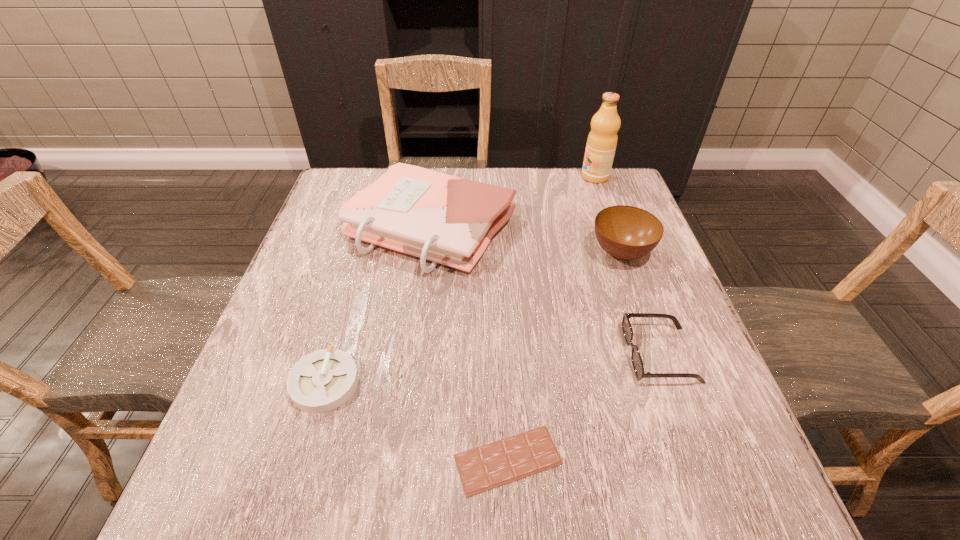
Identify the location of free space between the tallest object and the ashtray. (460, 280).

The width and height of the screenshot is (960, 540). I want to click on the closest object to the bowl, so click(636, 359).

Identify which object is located as the fourth nearest to the ashtray. Please provide its 2D coordinates. Your answer should be formatted as a tuple, i.e. [(x, y)], where the tuple contains the x and y coordinates of a point satisfying the conditions above.

[(625, 232)]

At what (x,y) coordinates should I click in order to perform the action: click on vacant area that satisfies the following two spatial constraints: 1. on the back side of the nearest object; 2. on the left side of the bowl. Please return your answer as a coordinate pair (x, y). Image resolution: width=960 pixels, height=540 pixels. Looking at the image, I should click on (498, 253).

The height and width of the screenshot is (540, 960). What are the coordinates of `free space that satisfies the following two spatial constraints: 1. on the front label of the tallest object; 2. on the front side of the shortest object` in the screenshot? It's located at (695, 460).

You are a GUI agent. You are given a task and a screenshot of the screen. Output one action in this format:
    pyautogui.click(x=<x>, y=<y>)
    Task: Click on the free spot that satisfies the following two spatial constraints: 1. on the front side of the phonebook; 2. on the right side of the nearest object
    This screenshot has height=540, width=960.
    Given the screenshot: What is the action you would take?
    401,460